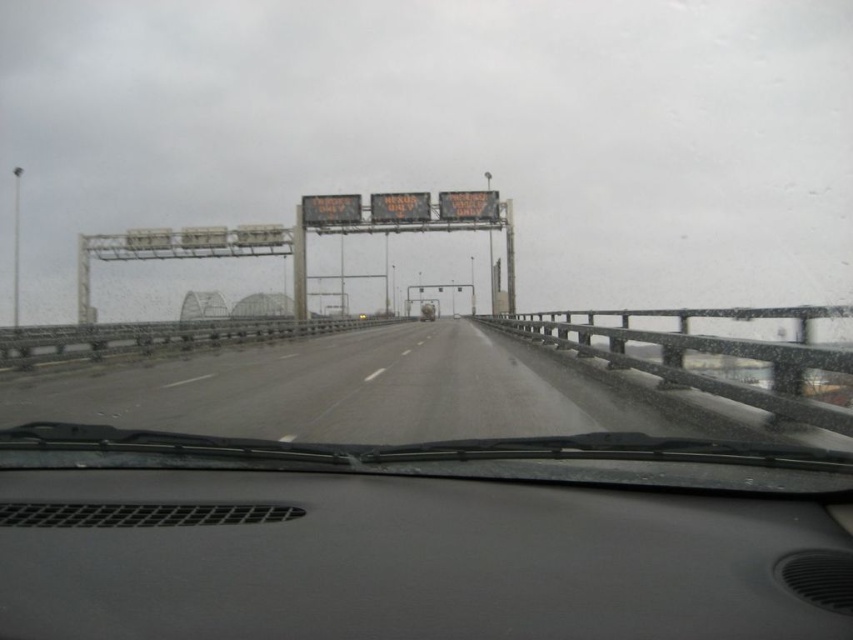
Question: Does gray matte dashboard at center appear on the right side of smooth asphalt highway at center?

Choices:
 (A) no
 (B) yes

Answer: (B)

Question: Which point is closer to the camera?

Choices:
 (A) smooth asphalt highway at center
 (B) gray matte dashboard at center

Answer: (B)

Question: Among these points, which one is nearest to the camera?

Choices:
 (A) (381, 627)
 (B) (184, 344)

Answer: (A)

Question: Is gray matte dashboard at center further to camera compared to smooth asphalt highway at center?

Choices:
 (A) no
 (B) yes

Answer: (A)

Question: Can you confirm if gray matte dashboard at center is smaller than smooth asphalt highway at center?

Choices:
 (A) no
 (B) yes

Answer: (B)